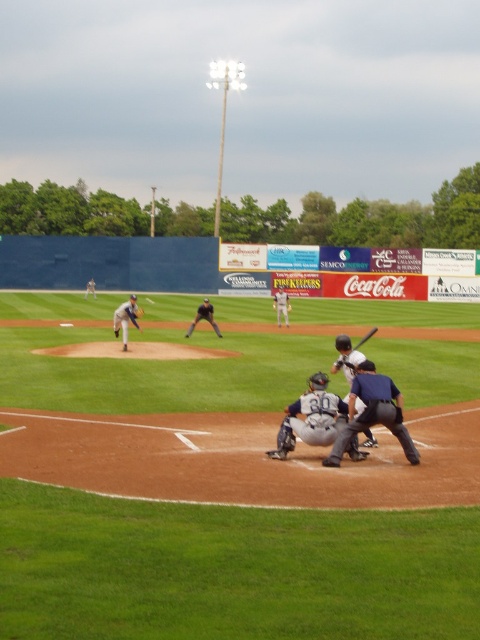
Is point (214, 330) positioned behind point (284, 307)?

No, it is not.

Is black leather baseball glove at center to the left of white jersey baseball player at center from the viewer's perspective?

Correct, you'll find black leather baseball glove at center to the left of white jersey baseball player at center.

What are the coordinates of `black leather baseball glove at center` in the screenshot? It's located at (204, 317).

Between gray matte catcher at center and white matte bat at center, which one appears on the left side from the viewer's perspective?

gray matte catcher at center

From the picture: Is gray matte catcher at center taller than white matte bat at center?

Incorrect, gray matte catcher at center's height is not larger of white matte bat at center's.

Is point (358, 458) behind point (348, 352)?

No, (358, 458) is closer to viewer.

Identify the location of gray matte catcher at center. (311, 417).

Which is behind, point (392, 392) or point (326, 376)?

Positioned behind is point (326, 376).

Consider the image. Who is more distant from viewer, (396, 388) or (335, 406)?

Positioned behind is point (335, 406).

At what (x,y) coordinates should I click in order to perform the action: click on dark blue uniform at center. Please return your answer as a coordinate pair (x, y). The image size is (480, 640). Looking at the image, I should click on (372, 412).